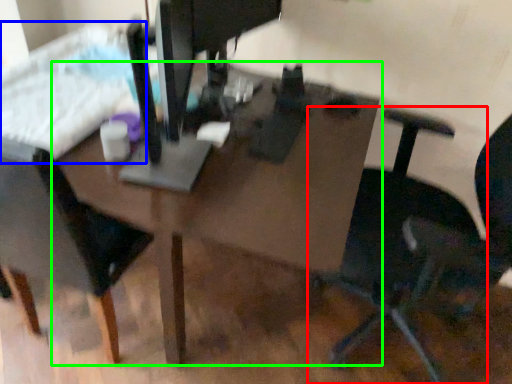
Question: Considering the real-world distances, which object is closest to chair (highlighted by a red box)? bed (highlighted by a blue box) or table (highlighted by a green box).

Choices:
 (A) bed
 (B) table

Answer: (B)